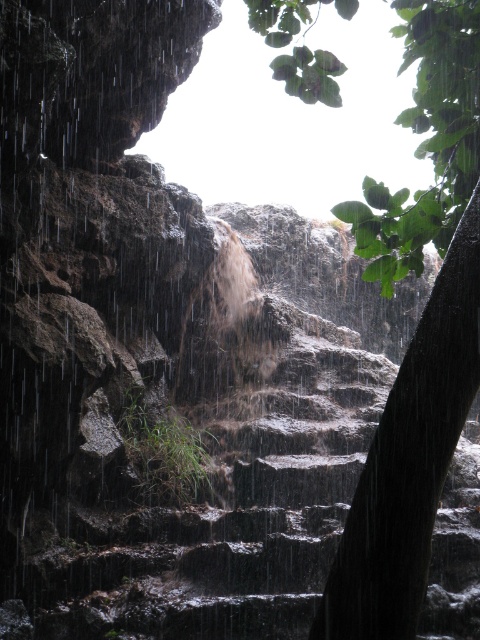
Question: Can you confirm if dark stone stairs at center is bigger than green leafy tree at upper right?

Choices:
 (A) yes
 (B) no

Answer: (A)

Question: Is dark stone stairs at center bigger than green leafy tree at upper right?

Choices:
 (A) no
 (B) yes

Answer: (B)

Question: Can you confirm if dark stone stairs at center is positioned to the right of green leafy tree at upper right?

Choices:
 (A) no
 (B) yes

Answer: (A)

Question: Which object appears farthest from the camera in this image?

Choices:
 (A) green leafy tree at upper right
 (B) dark stone stairs at center

Answer: (B)

Question: Which of the following is the farthest from the observer?

Choices:
 (A) green leafy tree at upper right
 (B) dark stone stairs at center

Answer: (B)

Question: Which of the following is the farthest from the observer?

Choices:
 (A) green leafy tree at upper right
 (B) dark stone stairs at center

Answer: (B)